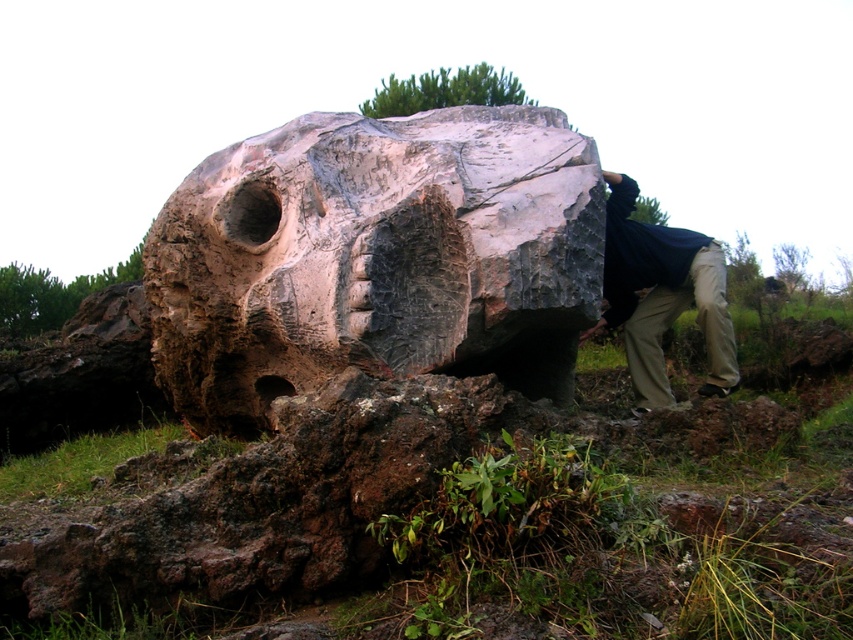
Question: Is rustic stone sculpture at center to the left of khaki pants at lower right from the viewer's perspective?

Choices:
 (A) no
 (B) yes

Answer: (B)

Question: Which object is the farthest from the rustic stone sculpture at center?

Choices:
 (A) khaki cotton pants at center
 (B) khaki pants at lower right

Answer: (B)

Question: Which point is closer to the camera taking this photo?

Choices:
 (A) pos(262,314)
 (B) pos(662,390)
 (C) pos(660,236)

Answer: (A)

Question: Is khaki cotton pants at center bigger than khaki pants at lower right?

Choices:
 (A) yes
 (B) no

Answer: (A)

Question: Based on their relative distances, which object is nearer to the rustic stone sculpture at center?

Choices:
 (A) khaki cotton pants at center
 (B) khaki pants at lower right

Answer: (A)

Question: Does rustic stone sculpture at center have a lesser width compared to khaki cotton pants at center?

Choices:
 (A) yes
 (B) no

Answer: (B)